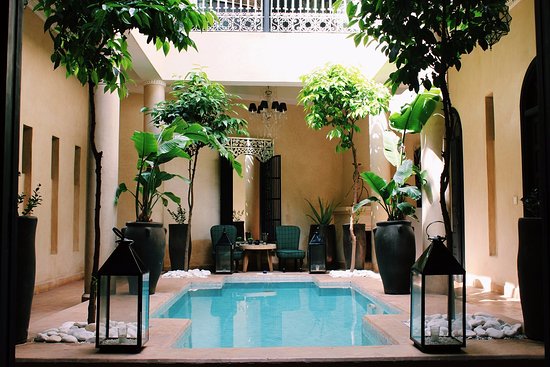
Identify the location of chandelier. (272, 105).